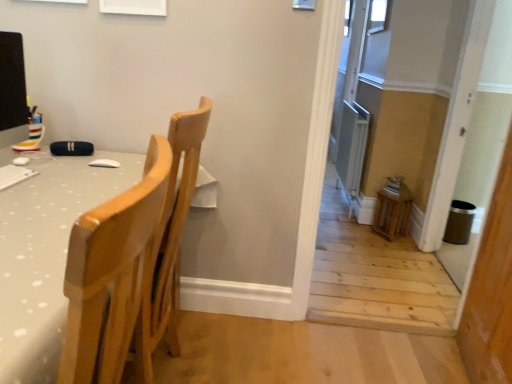
Locate an element on the screen. spots to the right of matte black monitor at left is located at coordinates (52, 167).